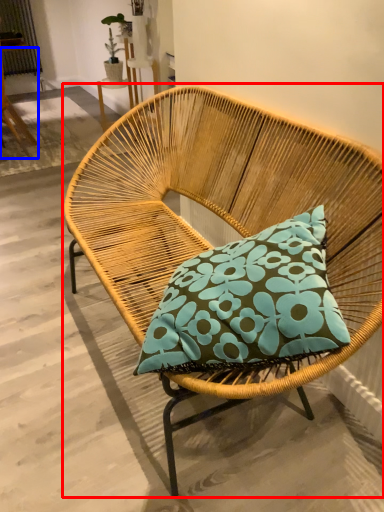
Question: Which object is closer to the camera taking this photo, chair (highlighted by a red box) or chair (highlighted by a blue box)?

Choices:
 (A) chair
 (B) chair

Answer: (A)